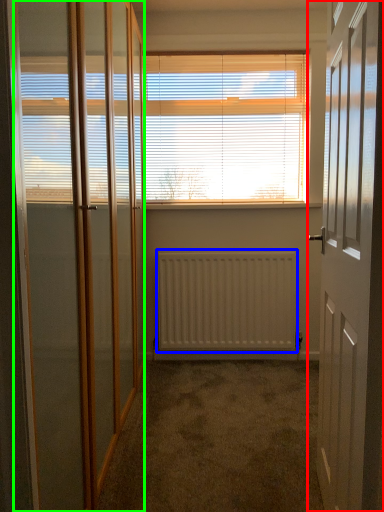
Question: Estimate the real-world distances between objects in this image. Which object is closer to door (highlighted by a red box), radiator (highlighted by a blue box) or screen door (highlighted by a green box)?

Choices:
 (A) radiator
 (B) screen door

Answer: (B)